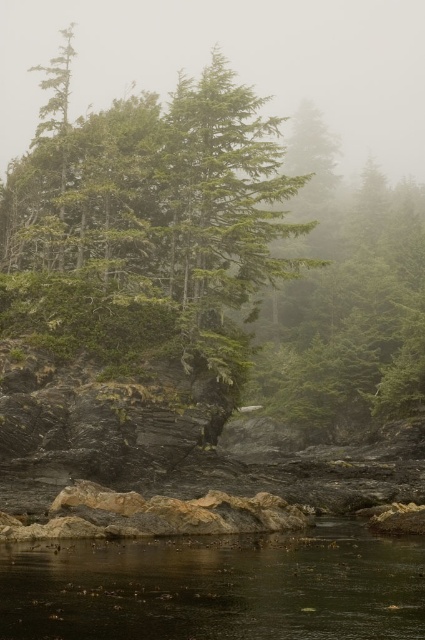
Between point (102, 32) and point (397, 556), which one is positioned in front?

Point (397, 556)

Can you confirm if foggy translucent mist at upper center is positioned above dark brown water at lower center?

Yes.

Is point (65, 4) behind point (419, 548)?

Yes, point (65, 4) is behind point (419, 548).

I want to click on foggy translucent mist at upper center, so click(x=234, y=64).

Is green matte tree at center below foggy translucent mist at upper center?

Yes, green matte tree at center is below foggy translucent mist at upper center.

Is green matte tree at center thinner than foggy translucent mist at upper center?

Indeed, green matte tree at center has a lesser width compared to foggy translucent mist at upper center.

Is point (184, 163) farther from camera compared to point (11, 134)?

No, (184, 163) is in front of (11, 134).

Identify the location of green matte tree at center. (218, 241).

Based on the photo, can you confirm if green matte tree at center is bigger than dark brown water at lower center?

Yes.

Is point (408, 285) closer to viewer compared to point (119, 588)?

No, (408, 285) is further to viewer.

Between point (365, 307) and point (312, 576), which one is positioned behind?

The point (365, 307) is behind.

This screenshot has height=640, width=425. I want to click on green matte tree at center, so click(x=218, y=241).